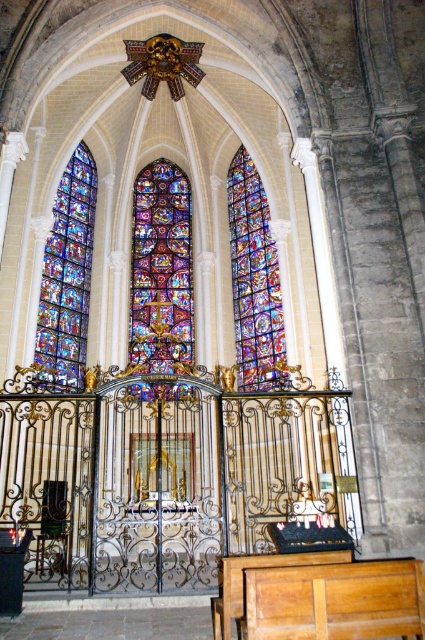
Which is more to the right, stained glass window at center or multicolored stained glass at center?

multicolored stained glass at center

Is stained glass window at center below multicolored stained glass at center?

Indeed, stained glass window at center is positioned under multicolored stained glass at center.

Where is `stained glass window at center`? The height and width of the screenshot is (640, 425). stained glass window at center is located at coordinates (161, 272).

Does stained glass window at center appear on the right side of stained glass window at left?

Correct, you'll find stained glass window at center to the right of stained glass window at left.

In the scene shown: Who is shorter, stained glass window at center or stained glass window at left?

Standing shorter between the two is stained glass window at center.

Does point (175, 356) come farther from viewer compared to point (82, 204)?

No, (175, 356) is closer to viewer.

I want to click on stained glass window at center, so click(x=161, y=272).

Between stained glass window at left and multicolored stained glass at center, which one appears on the left side from the viewer's perspective?

stained glass window at left is more to the left.

Does stained glass window at left have a smaller size compared to multicolored stained glass at center?

Correct, stained glass window at left occupies less space than multicolored stained glass at center.

What are the coordinates of `stained glass window at left` in the screenshot? It's located at [68, 273].

The width and height of the screenshot is (425, 640). In order to click on stained glass window at left in this screenshot , I will do `click(68, 273)`.